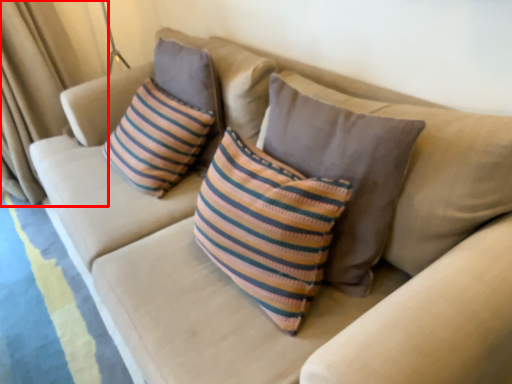
Question: From the image's perspective, what is the correct spatial positioning of curtain (annotated by the red box) in reference to pillow?

Choices:
 (A) below
 (B) above

Answer: (B)